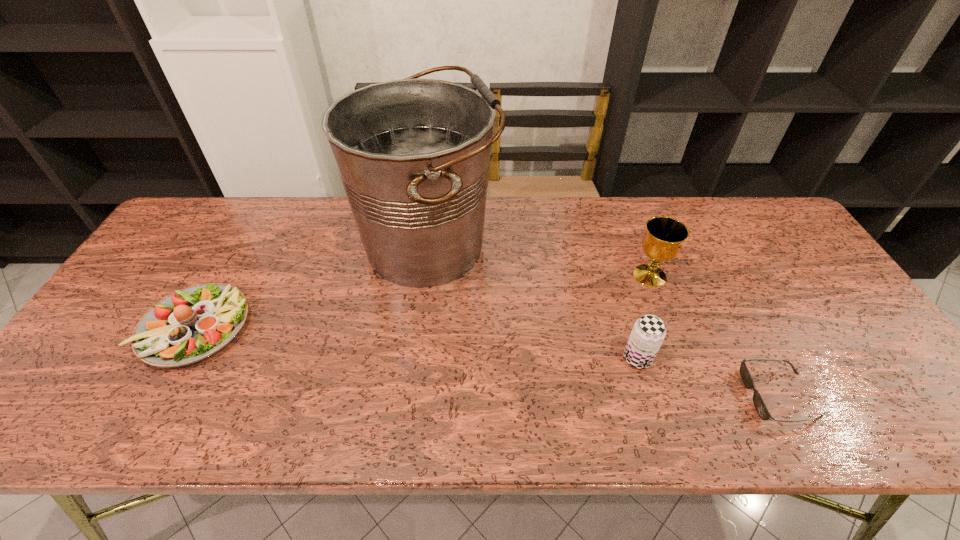
At what (x,y) coordinates should I click in order to perform the action: click on vacant area that lies between the rightmost object and the leftmost object. Please return your answer as a coordinate pair (x, y). This screenshot has height=540, width=960. Looking at the image, I should click on (487, 362).

At what (x,y) coordinates should I click in order to perform the action: click on unoccupied position between the fourth object from right to left and the third object from right to left. Please return your answer as a coordinate pair (x, y). The image size is (960, 540). Looking at the image, I should click on point(533,301).

Locate an element on the screen. This screenshot has width=960, height=540. vacant space that is in between the fourth object from left to right and the bucket is located at coordinates (540, 260).

I want to click on object that is the third nearest to the second object from left to right, so click(662, 242).

Image resolution: width=960 pixels, height=540 pixels. I want to click on the closest object relative to the second object from right to left, so click(x=648, y=333).

At what (x,y) coordinates should I click in order to perform the action: click on blank space that satisfies the following two spatial constraints: 1. on the front side of the bucket; 2. on the left side of the chalice. Please return your answer as a coordinate pair (x, y). Looking at the image, I should click on click(x=425, y=275).

Find the location of a particular element. The image size is (960, 540). free spot that satisfies the following two spatial constraints: 1. on the front side of the third object from right to left; 2. on the right side of the second shortest object is located at coordinates click(178, 359).